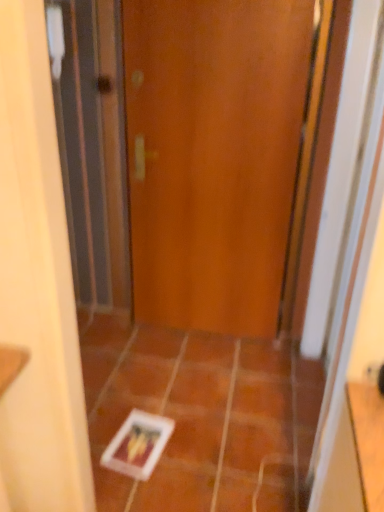
Locate an element on the screen. The width and height of the screenshot is (384, 512). blank space situated above orange matte tile at center, the 2th ceramic tile positioned from the left (from a real-world perspective) is located at coordinates (242, 456).